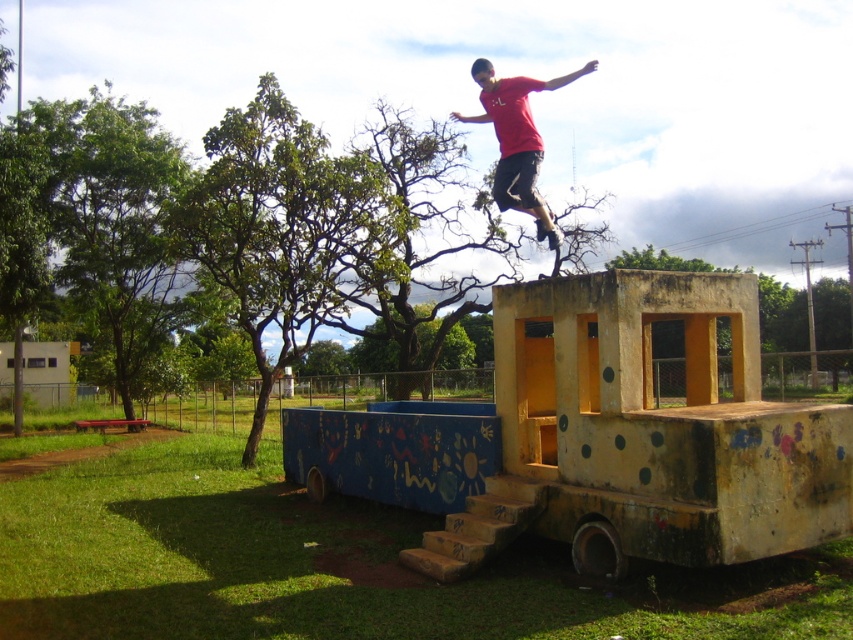
Can you confirm if painted wood obstacle at center is positioned to the left of red matte shirt at upper center?

Indeed, painted wood obstacle at center is positioned on the left side of red matte shirt at upper center.

This screenshot has width=853, height=640. I want to click on painted wood obstacle at center, so click(x=599, y=436).